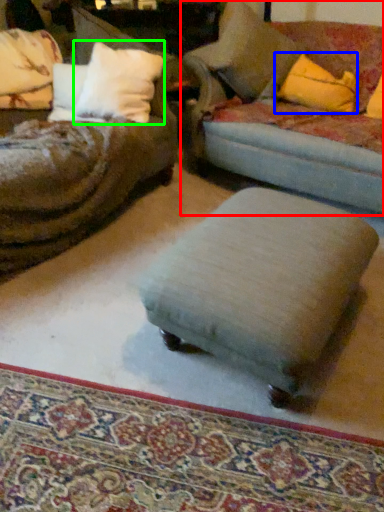
Question: Which object is the closest to the studio couch (highlighted by a red box)? Choose among these: throw pillow (highlighted by a blue box) or pillow (highlighted by a green box).

Choices:
 (A) throw pillow
 (B) pillow

Answer: (A)